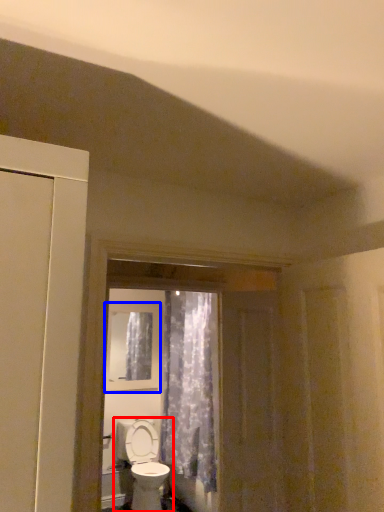
Question: Which object is closer to the camera taking this photo, toilet (highlighted by a red box) or window (highlighted by a blue box)?

Choices:
 (A) toilet
 (B) window

Answer: (A)